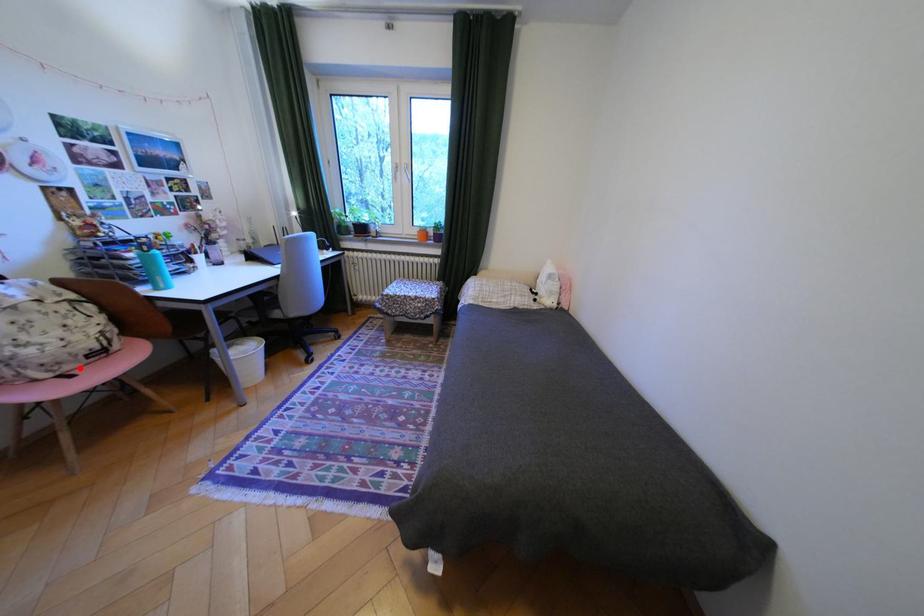
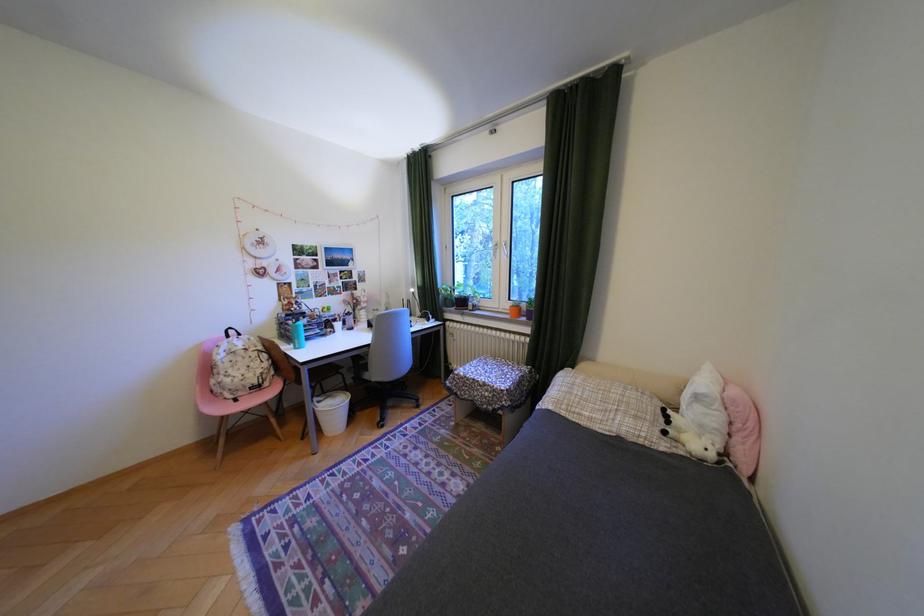
In the second image, find the point that corresponds to the highlighted location in the first image.

(251, 394)